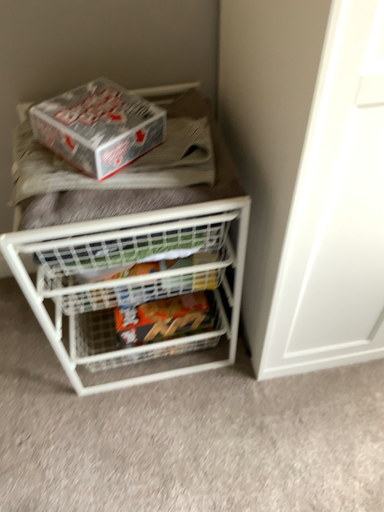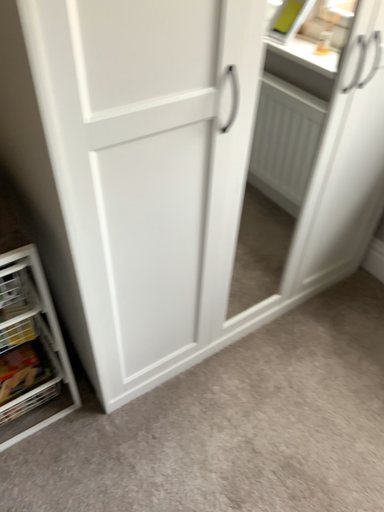
Question: Which way did the camera rotate in the video?

Choices:
 (A) rotated upward
 (B) rotated downward

Answer: (A)